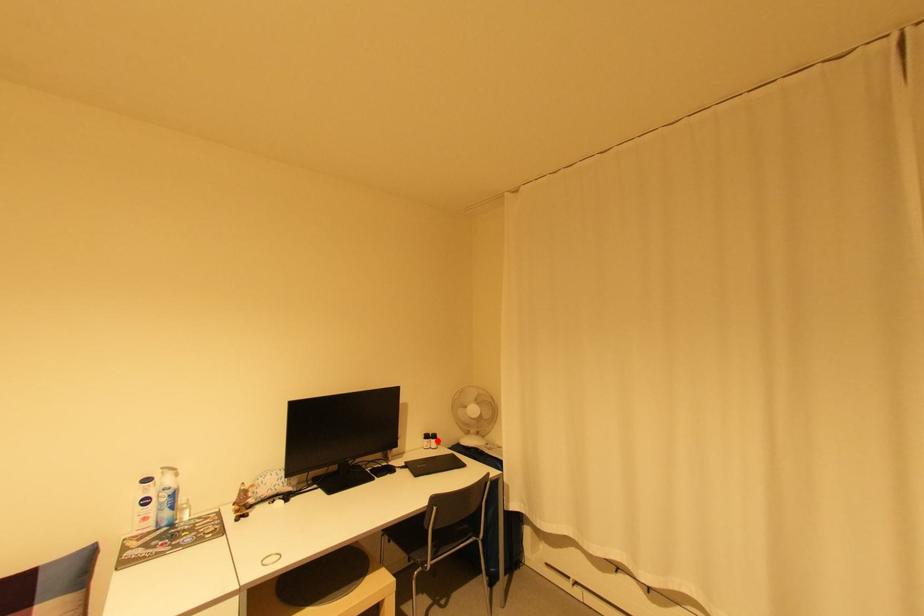
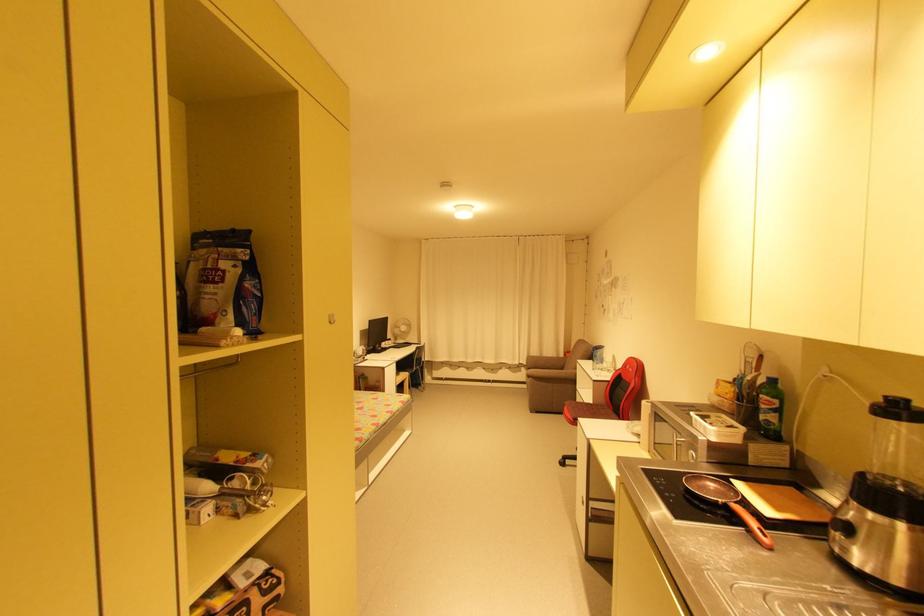
Question: I am providing you with two images of the same scene from different viewpoints. A red point is shown in image1. For the corresponding object point in image2, is it positioned nearer or farther from the camera?

Choices:
 (A) Nearer
 (B) Farther

Answer: (A)